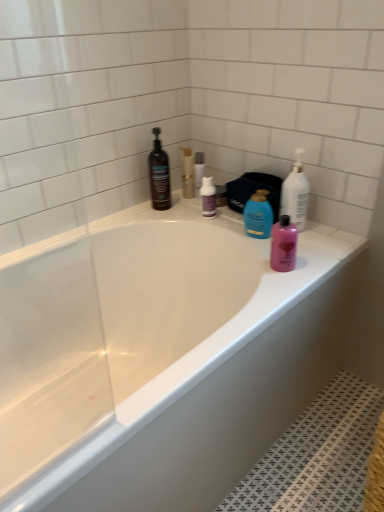
Question: From a real-world perspective, is clear plastic bottle at upper center, which is counted as the second toiletry, starting from the front, below matte black bottle at upper left, the 4th cleaning product when ordered from right to left?

Choices:
 (A) no
 (B) yes

Answer: (B)

Question: Is clear plastic bottle at upper center, marked as the 2th toiletry in a top-to-bottom arrangement, not inside matte black bottle at upper left, the 4th cleaning product when ordered from right to left?

Choices:
 (A) yes
 (B) no

Answer: (A)

Question: Can you confirm if clear plastic bottle at upper center, which is the 2th toiletry in right-to-left order, is wider than matte black bottle at upper left, the 4th cleaning product when ordered from right to left?

Choices:
 (A) no
 (B) yes

Answer: (A)

Question: Considering the relative sizes of clear plastic bottle at upper center, which is the 2th toiletry in right-to-left order, and matte black bottle at upper left, which is the 1th cleaning product from left to right, in the image provided, is clear plastic bottle at upper center, which is the 2th toiletry in right-to-left order, thinner than matte black bottle at upper left, which is the 1th cleaning product from left to right,?

Choices:
 (A) no
 (B) yes

Answer: (B)

Question: Considering the relative sizes of clear plastic bottle at upper center, which is the 2th toiletry in right-to-left order, and matte black bottle at upper left, the 4th cleaning product when ordered from right to left, in the image provided, is clear plastic bottle at upper center, which is the 2th toiletry in right-to-left order, bigger than matte black bottle at upper left, the 4th cleaning product when ordered from right to left,?

Choices:
 (A) yes
 (B) no

Answer: (B)

Question: From a real-world perspective, is gold metallic soap dispenser at upper center, marked as the first toiletry in a back-to-front arrangement, physically located above or below matte black bottle at upper left, which is the 1th cleaning product from left to right?

Choices:
 (A) below
 (B) above

Answer: (A)

Question: Considering the positions of gold metallic soap dispenser at upper center, which is the first toiletry in left-to-right order, and matte black bottle at upper left, which is the 1th cleaning product from left to right, in the image, is gold metallic soap dispenser at upper center, which is the first toiletry in left-to-right order, wider or thinner than matte black bottle at upper left, which is the 1th cleaning product from left to right,?

Choices:
 (A) wide
 (B) thin

Answer: (B)

Question: Would you say gold metallic soap dispenser at upper center, which is counted as the first toiletry, starting from the top, is inside or outside matte black bottle at upper left, the 4th cleaning product when ordered from right to left?

Choices:
 (A) outside
 (B) inside

Answer: (A)

Question: From the image's perspective, is gold metallic soap dispenser at upper center, placed as the third toiletry when sorted from bottom to top, located above or below matte black bottle at upper left, the 4th cleaning product when ordered from right to left?

Choices:
 (A) above
 (B) below

Answer: (A)

Question: Considering the positions of clear plastic bottle at upper center, the second toiletry viewed from the left, and purple matte bottle at center, which is the 2th cleaning product in left-to-right order, in the image, is clear plastic bottle at upper center, the second toiletry viewed from the left, bigger or smaller than purple matte bottle at center, which is the 2th cleaning product in left-to-right order,?

Choices:
 (A) small
 (B) big

Answer: (A)

Question: Relative to purple matte bottle at center, arranged as the third cleaning product when viewed from the right, is clear plastic bottle at upper center, the second toiletry when ordered from bottom to top, in front or behind?

Choices:
 (A) front
 (B) behind

Answer: (B)

Question: From the image's perspective, is clear plastic bottle at upper center, marked as the 2th toiletry in a top-to-bottom arrangement, above or below purple matte bottle at center, which is the 2th cleaning product in left-to-right order?

Choices:
 (A) above
 (B) below

Answer: (A)

Question: Is clear plastic bottle at upper center, the second toiletry when ordered from bottom to top, inside the boundaries of purple matte bottle at center, which is the 2th cleaning product in left-to-right order, or outside?

Choices:
 (A) outside
 (B) inside

Answer: (A)

Question: Is blue glossy bottle at upper center, the second cleaning product when ordered from right to left, bigger or smaller than gold metallic soap dispenser at upper center, marked as the first toiletry in a back-to-front arrangement?

Choices:
 (A) small
 (B) big

Answer: (B)

Question: From a real-world perspective, is blue glossy bottle at upper center, the second cleaning product when ordered from right to left, positioned above or below gold metallic soap dispenser at upper center, which is counted as the first toiletry, starting from the top?

Choices:
 (A) above
 (B) below

Answer: (B)